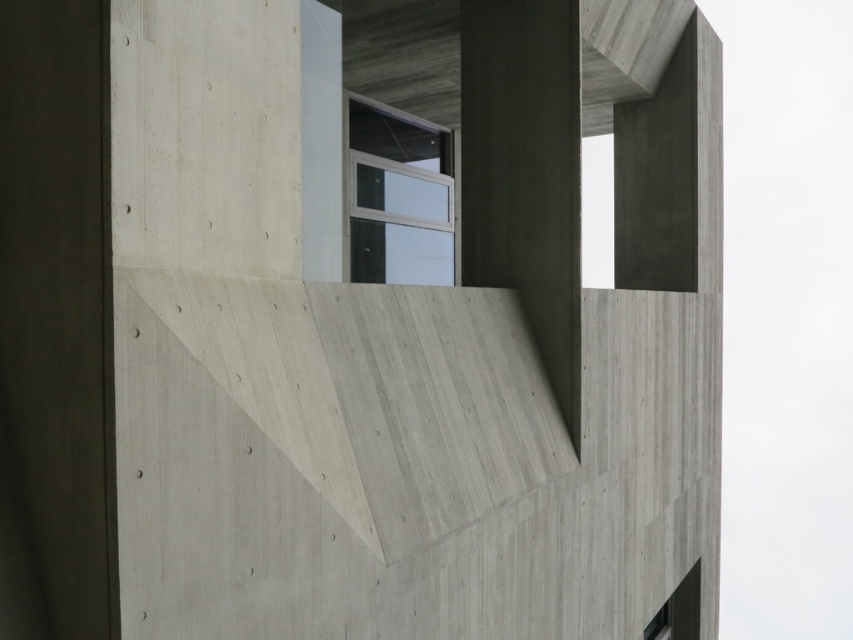
Does gray concrete at center appear on the left side of clear glass window at center?

In fact, gray concrete at center is to the right of clear glass window at center.

Which is below, gray concrete at center or clear glass window at center?

gray concrete at center is below.

Is point (622, 625) more distant than point (351, 184)?

Yes, point (622, 625) is farther from viewer.

Where is `gray concrete at center`? This screenshot has height=640, width=853. gray concrete at center is located at coordinates (415, 326).

Locate an element on the screen. The image size is (853, 640). gray concrete at center is located at coordinates (415, 326).

Between gray concrete at center and matte glass window at lower right, which one appears on the right side from the viewer's perspective?

matte glass window at lower right is more to the right.

Which is in front, point (367, 38) or point (650, 628)?

Point (367, 38) is more forward.

Identify the location of gray concrete at center. (415, 326).

Between point (416, 188) and point (695, 577), which one is positioned in front?

Point (416, 188) is in front.

Which is more to the right, clear glass window at center or matte glass window at lower right?

From the viewer's perspective, matte glass window at lower right appears more on the right side.

Locate an element on the screen. This screenshot has height=640, width=853. clear glass window at center is located at coordinates (398, 195).

Identify the location of clear glass window at center. The image size is (853, 640). (398, 195).